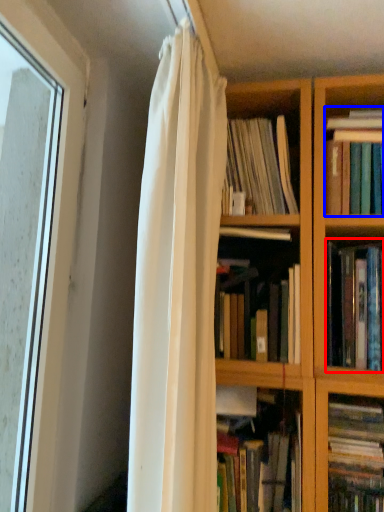
Question: Which object is further to the camera taking this photo, book (highlighted by a red box) or book (highlighted by a blue box)?

Choices:
 (A) book
 (B) book

Answer: (B)